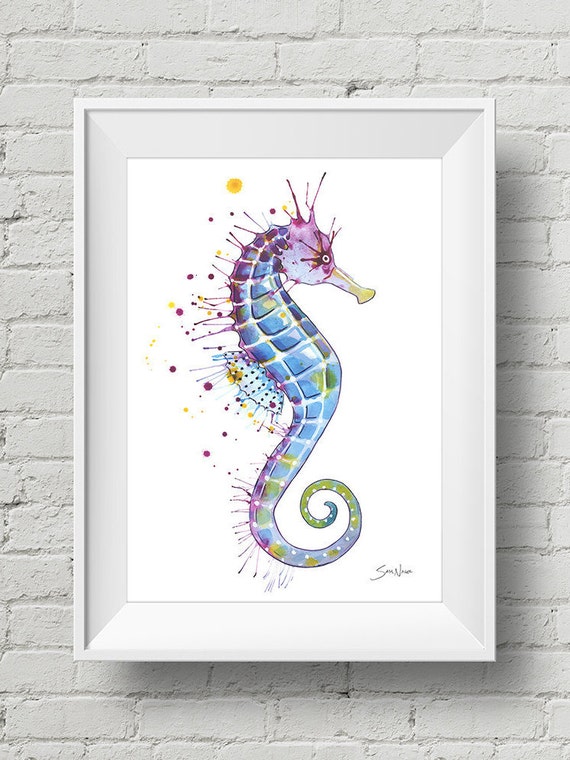
Locate an element on the screen. frame is located at coordinates tap(484, 580).